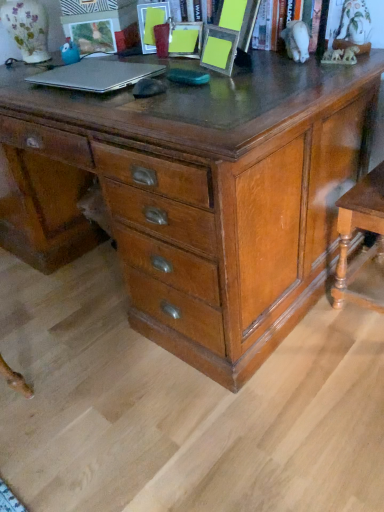
Where is `free space in front of matte plastic picture frame at upper center, which is the second picture frame in right-to-left order`? Image resolution: width=384 pixels, height=512 pixels. free space in front of matte plastic picture frame at upper center, which is the second picture frame in right-to-left order is located at coordinates (159, 60).